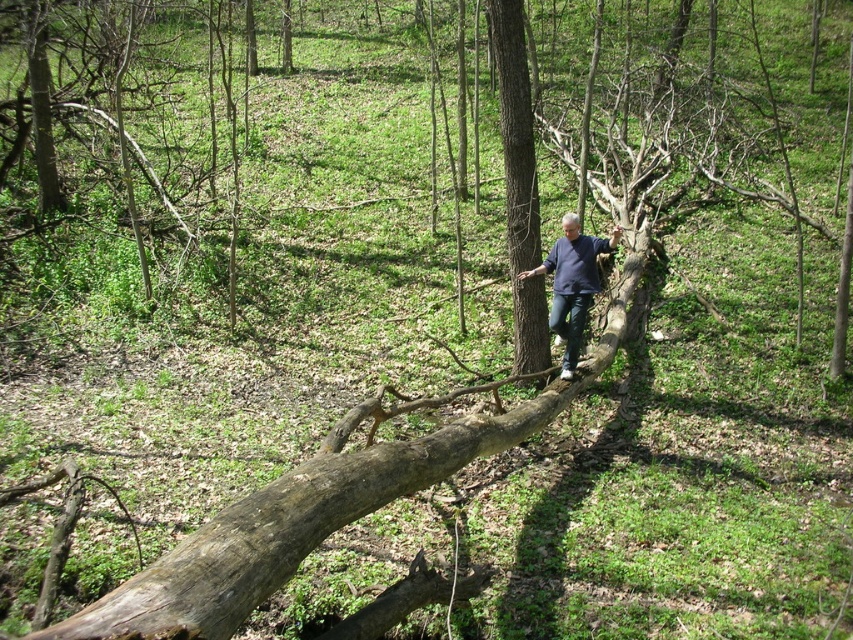
Is point (506, 64) more distant than point (573, 212)?

No, it is not.

Describe the element at coordinates (519, 186) in the screenshot. This screenshot has width=853, height=640. I see `brown rough tree trunk at center` at that location.

You are a GUI agent. You are given a task and a screenshot of the screen. Output one action in this format:
    pyautogui.click(x=<x>, y=<y>)
    Task: Click on the brown rough tree trunk at center
    This screenshot has width=853, height=640.
    Given the screenshot: What is the action you would take?
    pyautogui.click(x=519, y=186)